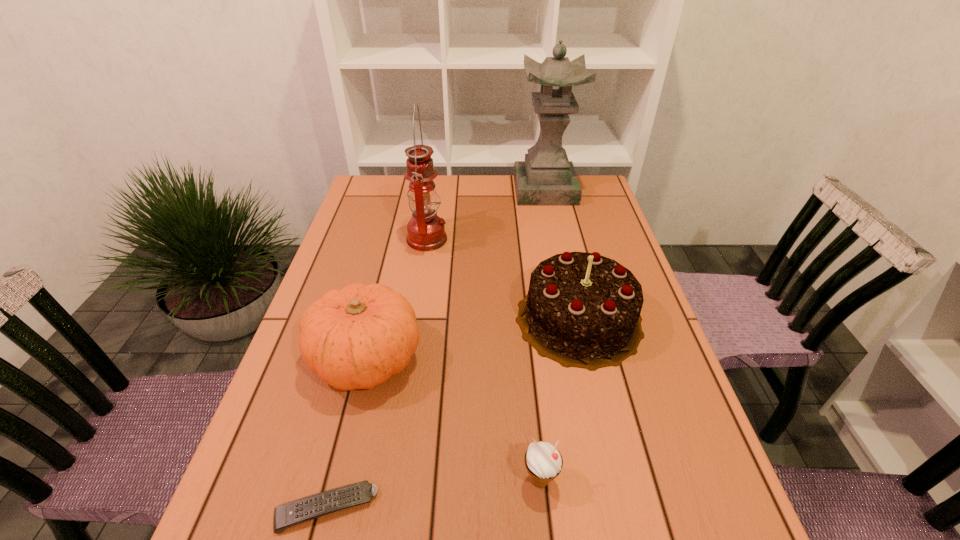
I want to click on blank area at the left edge, so click(x=271, y=427).

What are the coordinates of `free space at the right edge` in the screenshot? It's located at (711, 495).

Locate an element on the screen. blank space at the far left corner of the desktop is located at coordinates (389, 202).

In order to click on vacant area that lies between the farthest object and the fifth shortest object in this screenshot , I will do `click(486, 215)`.

Where is `empty location between the farthest object and the pumpkin`? This screenshot has height=540, width=960. empty location between the farthest object and the pumpkin is located at coordinates (456, 274).

You are a GUI agent. You are given a task and a screenshot of the screen. Output one action in this format:
    pyautogui.click(x=<x>, y=<y>)
    Task: Click on the free space between the remote control and the pumpkin
    This screenshot has height=540, width=960.
    Given the screenshot: What is the action you would take?
    [x=347, y=433]

Where is `empty location between the shortest object and the tallest object`? The height and width of the screenshot is (540, 960). empty location between the shortest object and the tallest object is located at coordinates tap(436, 349).

The height and width of the screenshot is (540, 960). Find the location of `vacant point located between the fifth tallest object and the oil lamp`. vacant point located between the fifth tallest object and the oil lamp is located at coordinates (484, 360).

Locate an element on the screen. This screenshot has width=960, height=540. the third closest object relative to the fourth shortest object is located at coordinates (356, 338).

The width and height of the screenshot is (960, 540). What are the coordinates of `object that is the fourth closest to the shortest object` in the screenshot? It's located at (426, 232).